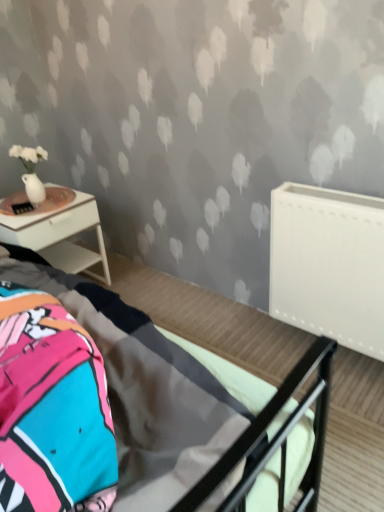
Question: Is white glossy nightstand at left bigger than metallic gray bed at center?

Choices:
 (A) yes
 (B) no

Answer: (B)

Question: Can you confirm if white glossy nightstand at left is thinner than metallic gray bed at center?

Choices:
 (A) yes
 (B) no

Answer: (A)

Question: From a real-world perspective, is white glossy nightstand at left positioned over metallic gray bed at center based on gravity?

Choices:
 (A) no
 (B) yes

Answer: (A)

Question: Is white glossy nightstand at left touching metallic gray bed at center?

Choices:
 (A) no
 (B) yes

Answer: (A)

Question: Is white glossy nightstand at left in front of metallic gray bed at center?

Choices:
 (A) no
 (B) yes

Answer: (A)

Question: Do you think metallic gray bed at center is within white matte radiator at right, or outside of it?

Choices:
 (A) inside
 (B) outside

Answer: (B)

Question: In terms of width, does metallic gray bed at center look wider or thinner when compared to white matte radiator at right?

Choices:
 (A) thin
 (B) wide

Answer: (B)

Question: In the image, is metallic gray bed at center positioned in front of or behind white matte radiator at right?

Choices:
 (A) front
 (B) behind

Answer: (A)

Question: From a real-world perspective, is metallic gray bed at center positioned above or below white matte radiator at right?

Choices:
 (A) below
 (B) above

Answer: (B)

Question: Considering the positions of white matte radiator at right and metallic gray bed at center in the image, is white matte radiator at right wider or thinner than metallic gray bed at center?

Choices:
 (A) thin
 (B) wide

Answer: (A)

Question: In the image, is white matte radiator at right positioned in front of or behind metallic gray bed at center?

Choices:
 (A) behind
 (B) front

Answer: (A)

Question: In terms of height, does white matte radiator at right look taller or shorter compared to metallic gray bed at center?

Choices:
 (A) short
 (B) tall

Answer: (A)

Question: Considering the relative positions of white matte radiator at right and metallic gray bed at center in the image provided, is white matte radiator at right to the left or to the right of metallic gray bed at center?

Choices:
 (A) right
 (B) left

Answer: (A)

Question: From their relative heights in the image, would you say metallic gray bed at center is taller or shorter than white glossy nightstand at left?

Choices:
 (A) tall
 (B) short

Answer: (A)

Question: From the image's perspective, relative to white glossy nightstand at left, is metallic gray bed at center above or below?

Choices:
 (A) above
 (B) below

Answer: (B)